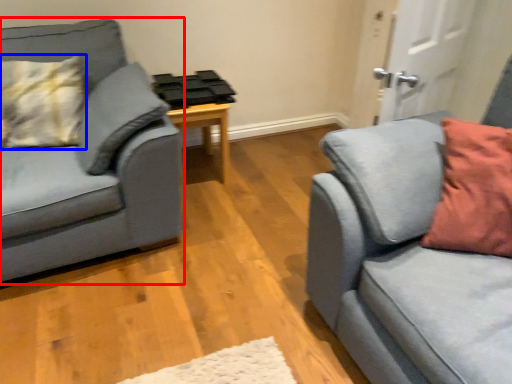
Question: Which object is closer to the camera taking this photo, studio couch (highlighted by a red box) or pillow (highlighted by a blue box)?

Choices:
 (A) studio couch
 (B) pillow

Answer: (A)